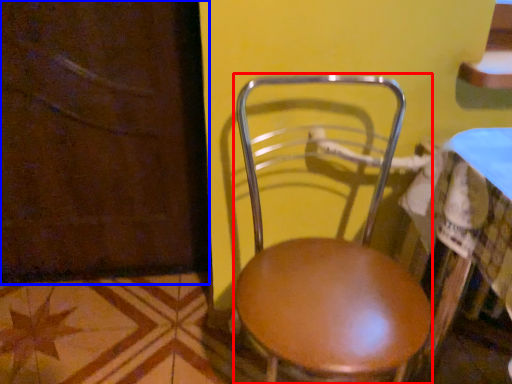
Question: Among these objects, which one is farthest to the camera, chair (highlighted by a red box) or screen door (highlighted by a blue box)?

Choices:
 (A) chair
 (B) screen door

Answer: (B)